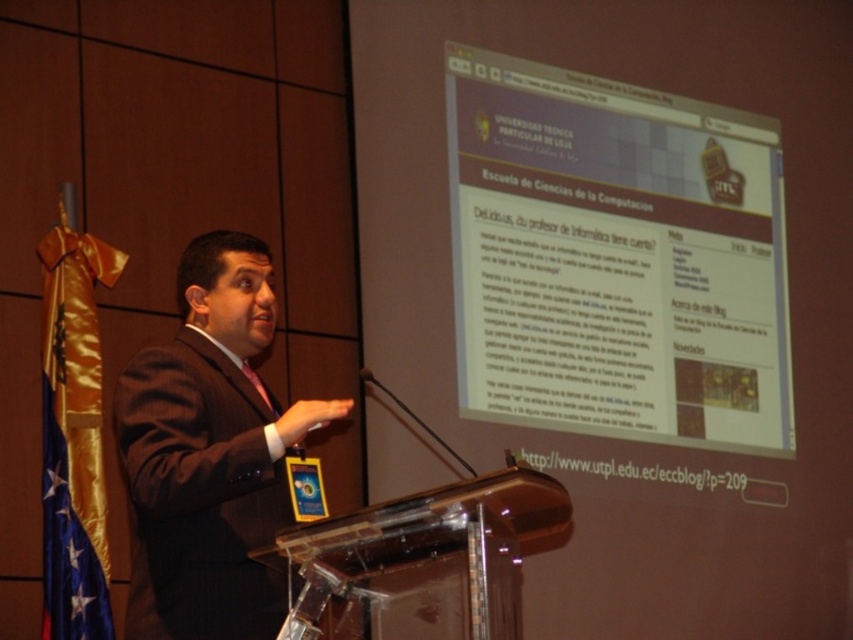
You are an attendee sitting in the front row of the conference room. You notice the brown suit at center and the matte plastic screen at upper right. Which object is closer to you?

The brown suit at center is closer to you because it is in front of the matte plastic screen at upper right.

In the scene shown: You are an attendee at the presentation. The presenter is wearing a brown suit at center and there is a matte plastic screen at upper right. Which object is taller?

The matte plastic screen at upper right is much taller than the brown suit at center.

In the scene shown: You are a photographer standing in the conference room. You need to capture a photo of the brown suit at center and the blue satin flag at left. The camera you are using has a minimum focus distance of 5 feet. Can you take a photo where both objects are in focus without moving either object?

The brown suit at center and the blue satin flag at left are 5.13 feet apart. Since the distance between them is greater than the camera minimum focus distance of 5 feet, you can take a photo where both objects are in focus without moving them.